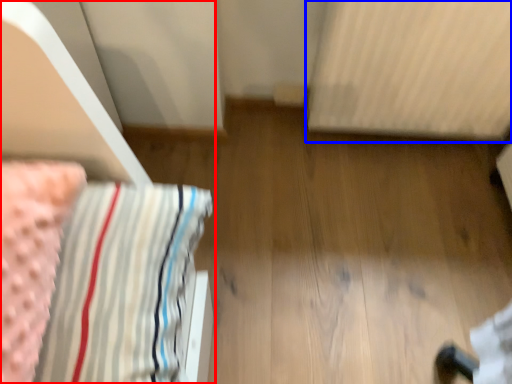
Question: Which point is closer to the camera, furniture (highlighted by a red box) or radiator (highlighted by a blue box)?

Choices:
 (A) furniture
 (B) radiator

Answer: (A)